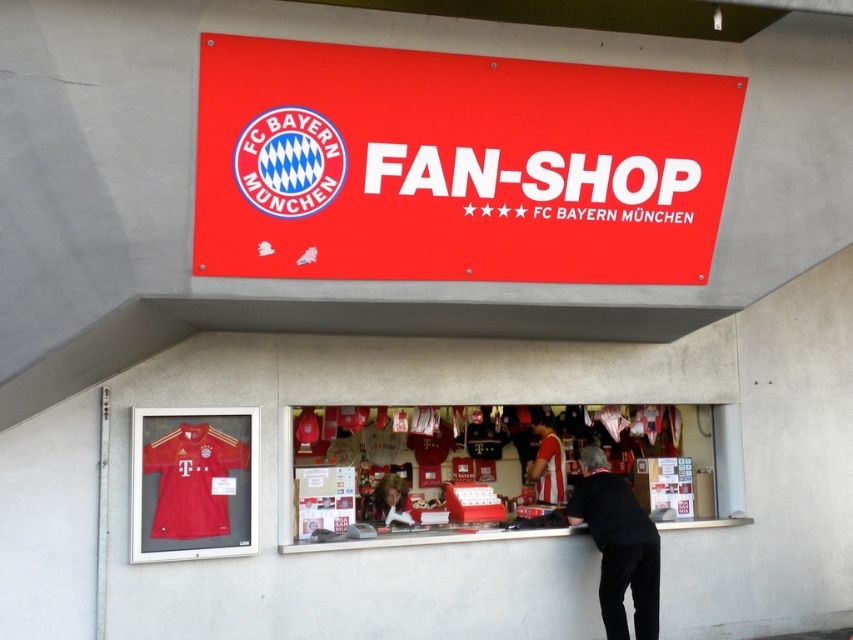
In the scene shown: Is red matte sign at upper center shorter than black fabric at lower right?

Yes.

Is point (555, 188) positioned before point (656, 538)?

Yes, point (555, 188) is closer to viewer.

I want to click on red matte sign at upper center, so click(454, 164).

Who is taller, red matte sign at upper center or matte jersey at center?

red matte sign at upper center

Is red matte sign at upper center positioned at the back of matte jersey at center?

No, it is not.

Measure the distance between red matte sign at upper center and camera.

red matte sign at upper center is 14.86 feet from camera.

Identify the location of red matte sign at upper center. (454, 164).

From the picture: Who is more forward, (546, 417) or (387, 490)?

Point (387, 490) is in front.

Is striped jersey at center to the left of smooth white shirt at center from the viewer's perspective?

In fact, striped jersey at center is to the right of smooth white shirt at center.

Image resolution: width=853 pixels, height=640 pixels. Describe the element at coordinates (547, 461) in the screenshot. I see `striped jersey at center` at that location.

The image size is (853, 640). In order to click on striped jersey at center in this screenshot , I will do `click(547, 461)`.